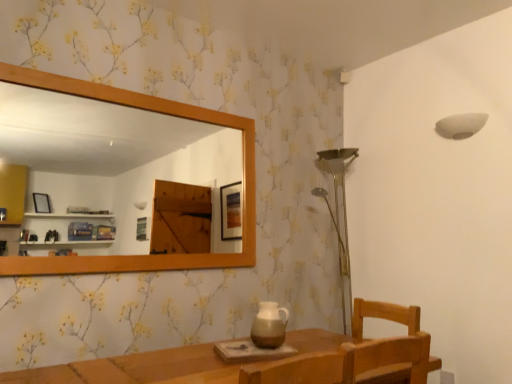
Question: From the image's perspective, is wooden mirror at upper left above or below white matte lampshade at upper right?

Choices:
 (A) above
 (B) below

Answer: (B)

Question: Does point (118, 172) appear closer or farther from the camera than point (463, 127)?

Choices:
 (A) closer
 (B) farther

Answer: (B)

Question: Which of these objects is positioned closest to the white matte lampshade at upper right?

Choices:
 (A) brown ceramic pitcher at center
 (B) wooden mirror at upper left

Answer: (A)

Question: Which is nearer to the brown ceramic pitcher at center?

Choices:
 (A) wooden mirror at upper left
 (B) white matte lampshade at upper right

Answer: (B)